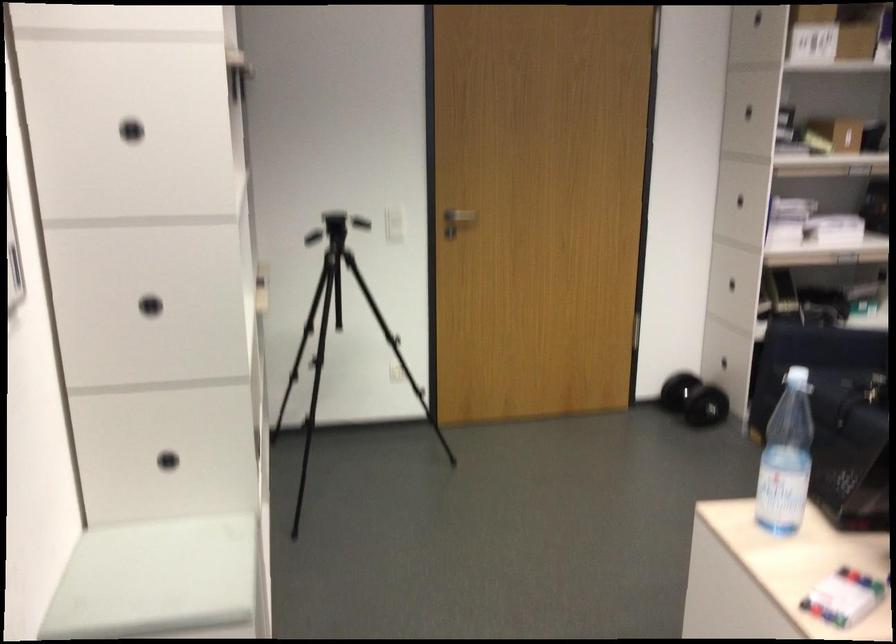
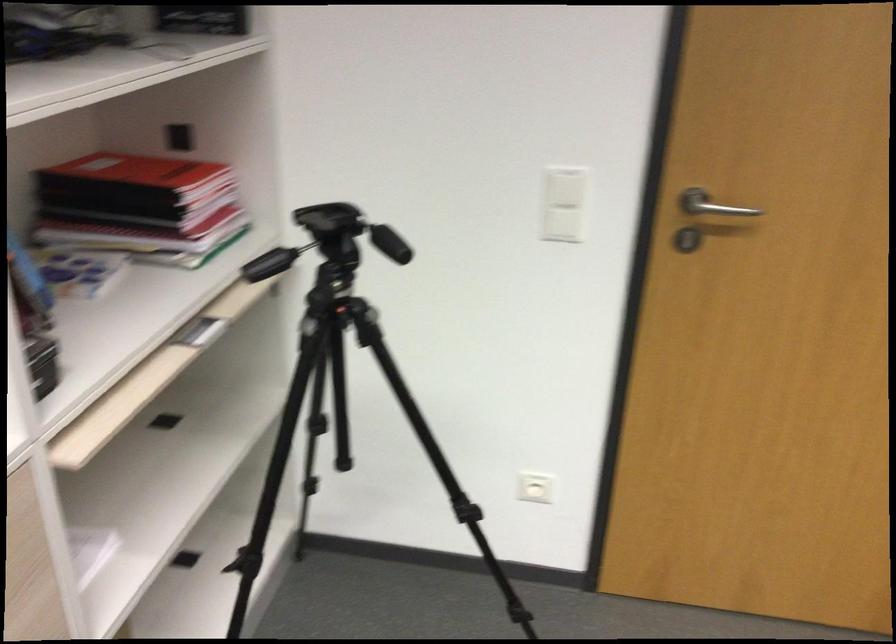
Where in the second image is the point corresponding to (x=371, y=212) from the first image?

(565, 187)